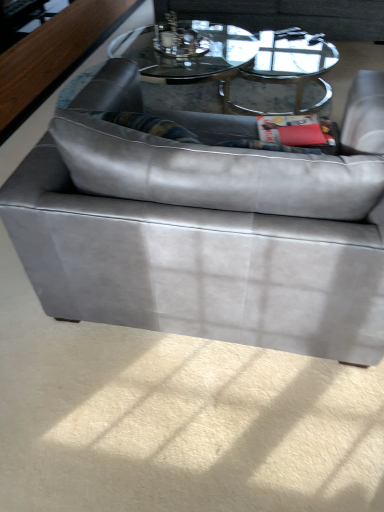
I want to click on suede gray studio couch at center, so click(205, 229).

What do you see at coordinates (205, 229) in the screenshot?
I see `suede gray studio couch at center` at bounding box center [205, 229].

Where is `suede gray studio couch at center`? Image resolution: width=384 pixels, height=512 pixels. suede gray studio couch at center is located at coordinates coord(205,229).